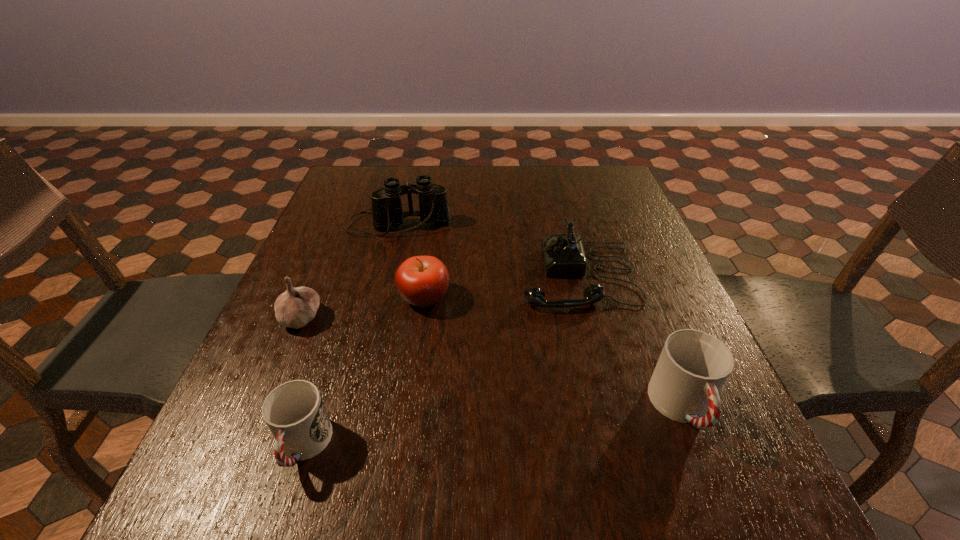
Where is `free space for an extra cup to achieve even spacing`? The height and width of the screenshot is (540, 960). free space for an extra cup to achieve even spacing is located at coordinates (499, 427).